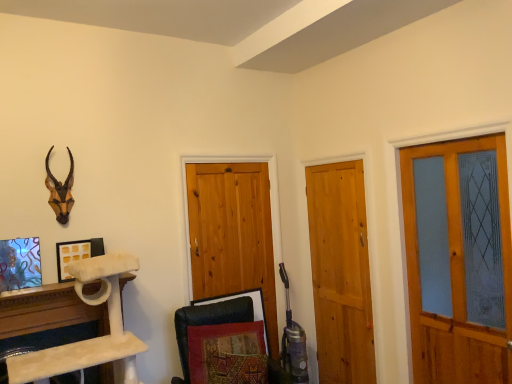
Question: From a real-world perspective, relative to white matte picture frame at upper left, which appears as the second picture frame when viewed from the front, is white marble cat tree at lower left vertically above or below?

Choices:
 (A) below
 (B) above

Answer: (A)

Question: Is white marble cat tree at lower left in front of or behind white matte picture frame at upper left, the first picture frame viewed from the back, in the image?

Choices:
 (A) front
 (B) behind

Answer: (A)

Question: Based on their relative distances, which object is nearer to the brown matte/decorative animal head at upper left?

Choices:
 (A) black leather swivel chair at lower center
 (B) matte wooden screen door at right
 (C) natural wood barn door at center, which is the first barn door from left to right
 (D) stained glass picture frame at lower left, marked as the first picture frame in a left-to-right arrangement
 (E) white marble cat tree at lower left

Answer: (D)

Question: Considering the real-world distances, which object is farthest from the black leather swivel chair at lower center?

Choices:
 (A) brown matte/decorative animal head at upper left
 (B) light brown wooden door at center, marked as the 2th barn door in a left-to-right arrangement
 (C) matte wooden screen door at right
 (D) white matte picture frame at upper left, the first picture frame when ordered from right to left
 (E) stained glass picture frame at lower left, arranged as the 2th picture frame when viewed from the right

Answer: (C)